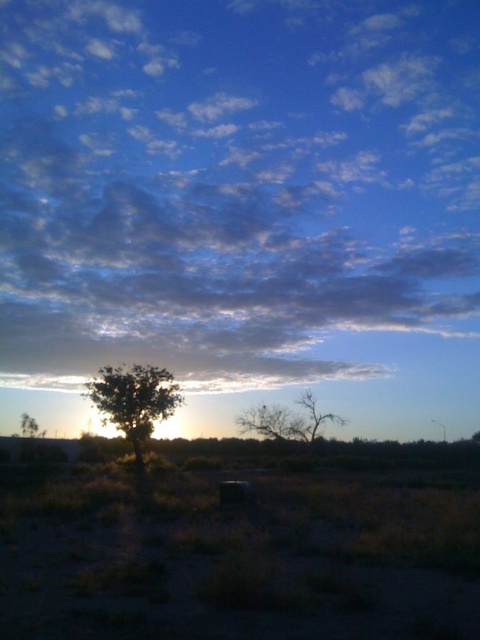
You are an artist sketching the scene. You notice the cloudy blue sky at upper center and the green matte tree at left. Which object is located to the right of the other?

The cloudy blue sky at upper center is positioned on the right side of green matte tree at left.